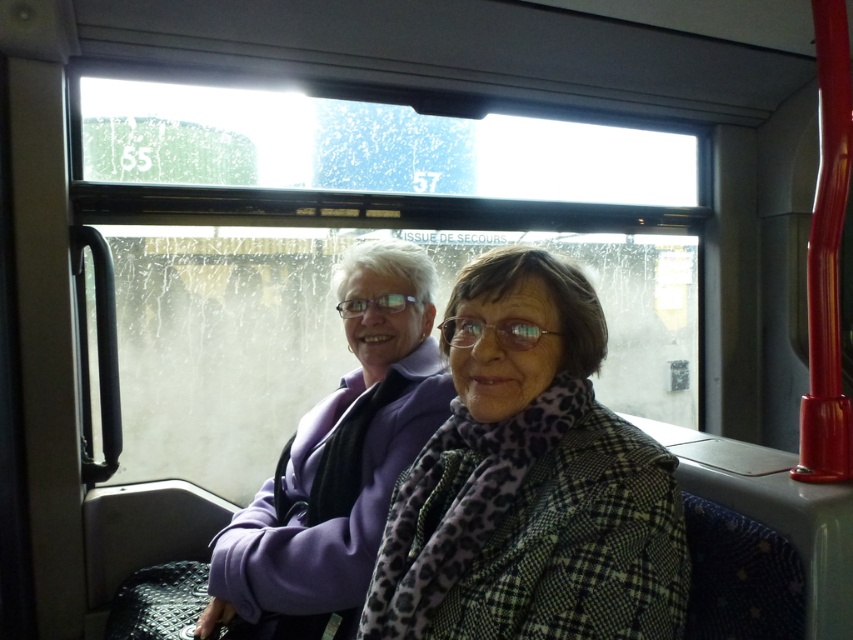
Question: Which point appears closest to the camera in this image?

Choices:
 (A) (289, 440)
 (B) (579, 497)

Answer: (B)

Question: Observing the image, what is the correct spatial positioning of green checkered coat at center in reference to purple fabric at center?

Choices:
 (A) left
 (B) right

Answer: (B)

Question: Which of the following is the farthest from the observer?

Choices:
 (A) purple fabric at center
 (B) green checkered coat at center

Answer: (A)

Question: Can you confirm if green checkered coat at center is positioned to the left of purple fabric at center?

Choices:
 (A) no
 (B) yes

Answer: (A)

Question: Which object is closer to the camera taking this photo?

Choices:
 (A) green checkered coat at center
 (B) purple fabric at center

Answer: (A)

Question: Does green checkered coat at center have a larger size compared to purple fabric at center?

Choices:
 (A) yes
 (B) no

Answer: (B)